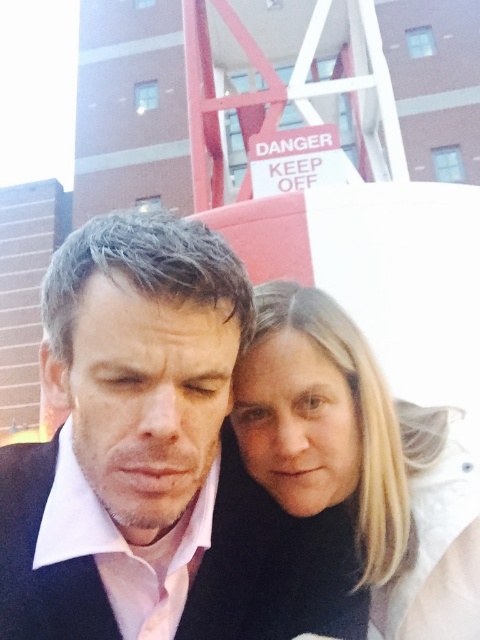
Does pink satin shirt at center have a lesser height compared to blonde hair at center?

In fact, pink satin shirt at center may be taller than blonde hair at center.

Who is lower down, pink satin shirt at center or blonde hair at center?

Positioned lower is blonde hair at center.

Between point (170, 428) and point (406, 593), which one is positioned in front?

Positioned in front is point (170, 428).

I want to click on pink satin shirt at center, so click(x=156, y=461).

Does blonde hair at center have a lesser height compared to black matte suit at center?

No, blonde hair at center is not shorter than black matte suit at center.

The height and width of the screenshot is (640, 480). What are the coordinates of `blonde hair at center` in the screenshot? It's located at pyautogui.click(x=360, y=461).

Where is `blonde hair at center`? blonde hair at center is located at coordinates (360, 461).

Which is above, pink satin shirt at center or black matte suit at center?

pink satin shirt at center

Locate an element on the screen. The height and width of the screenshot is (640, 480). pink satin shirt at center is located at coordinates (156, 461).

Identify the location of pink satin shirt at center. This screenshot has width=480, height=640. (156, 461).